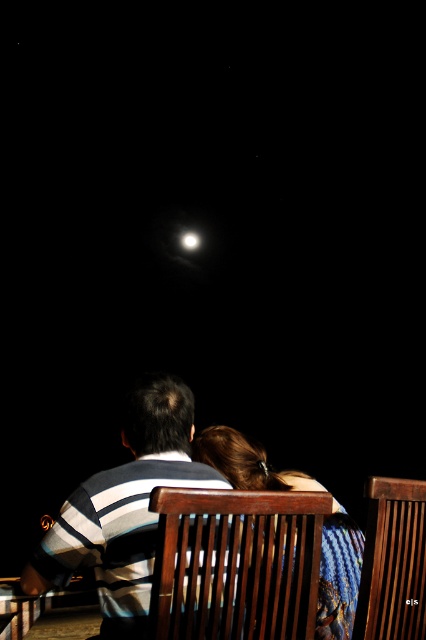
Is striped fabric shirt at center to the right of bright white orb at center from the viewer's perspective?

Yes, striped fabric shirt at center is to the right of bright white orb at center.

Is point (172, 385) positioned before point (195, 234)?

That is True.

Is point (111, 515) farther from viewer compared to point (181, 241)?

No, (111, 515) is in front of (181, 241).

At what (x,y) coordinates should I click in order to perform the action: click on striped fabric shirt at center. Please return your answer as a coordinate pair (x, y). The height and width of the screenshot is (640, 426). Looking at the image, I should click on (124, 508).

Does striped fabric shirt at center appear over blue textured fabric at center?

Correct, striped fabric shirt at center is located above blue textured fabric at center.

Is striped fabric shirt at center positioned before blue textured fabric at center?

Yes, striped fabric shirt at center is in front of blue textured fabric at center.

The image size is (426, 640). Describe the element at coordinates (124, 508) in the screenshot. I see `striped fabric shirt at center` at that location.

This screenshot has width=426, height=640. Identify the location of striped fabric shirt at center. (124, 508).

Does blue textured fabric at center have a lesser height compared to bright white orb at center?

No, blue textured fabric at center is not shorter than bright white orb at center.

Which is in front, point (267, 467) or point (189, 230)?

Point (267, 467)

Is point (250, 449) in front of point (180, 241)?

Yes.

You are a GUI agent. You are given a task and a screenshot of the screen. Output one action in this format:
    pyautogui.click(x=<x>, y=<y>)
    Task: Click on the blue textured fabric at center
    The image size is (426, 640).
    Given the screenshot: What is the action you would take?
    pyautogui.click(x=339, y=576)